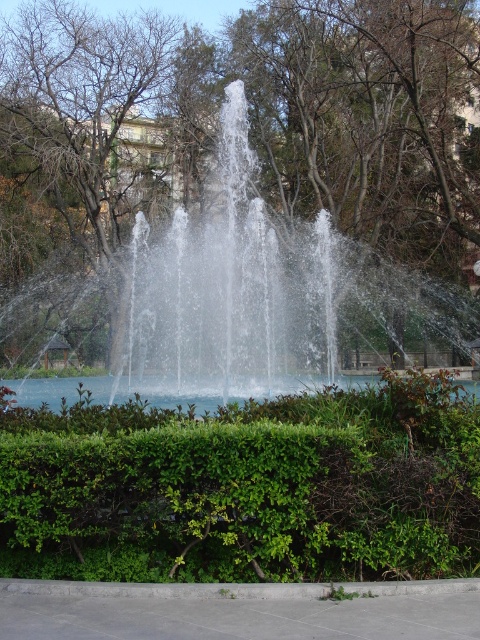
Which is more to the right, clear water fountain at center or clear water at center?

From the viewer's perspective, clear water at center appears more on the right side.

Who is positioned more to the left, clear water fountain at center or clear water at center?

From the viewer's perspective, clear water fountain at center appears more on the left side.

Between point (419, 349) and point (109, 378), which one is positioned behind?

Point (419, 349)

Locate an element on the screen. The width and height of the screenshot is (480, 640). clear water fountain at center is located at coordinates (265, 298).

Does green leafy hedge at center have a smaller size compared to clear water fountain at center?

Correct, green leafy hedge at center occupies less space than clear water fountain at center.

Can you confirm if green leafy hedge at center is thinner than clear water fountain at center?

Correct, green leafy hedge at center's width is less than clear water fountain at center's.

Who is more distant from viewer, (226, 486) or (92, 300)?

Positioned behind is point (92, 300).

I want to click on green leafy hedge at center, so click(247, 486).

Which is above, green leafy hedge at center or clear water at center?

Positioned higher is green leafy hedge at center.

How much distance is there between green leafy hedge at center and clear water at center?

A distance of 3.98 meters exists between green leafy hedge at center and clear water at center.

Does point (144, 497) lie in front of point (372, 376)?

Yes, it is in front of point (372, 376).

Locate an element on the screen. green leafy hedge at center is located at coordinates (247, 486).